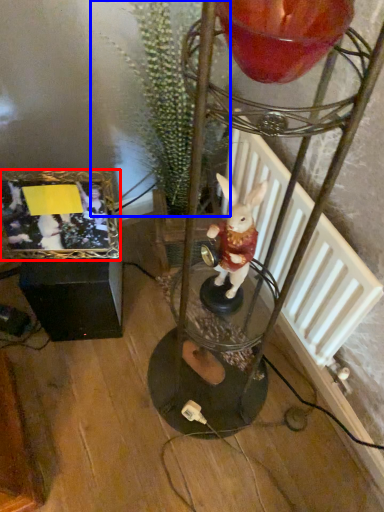
Question: Which object appears farthest to the camera in this image, picture frame (highlighted by a red box) or plant (highlighted by a blue box)?

Choices:
 (A) picture frame
 (B) plant

Answer: (A)